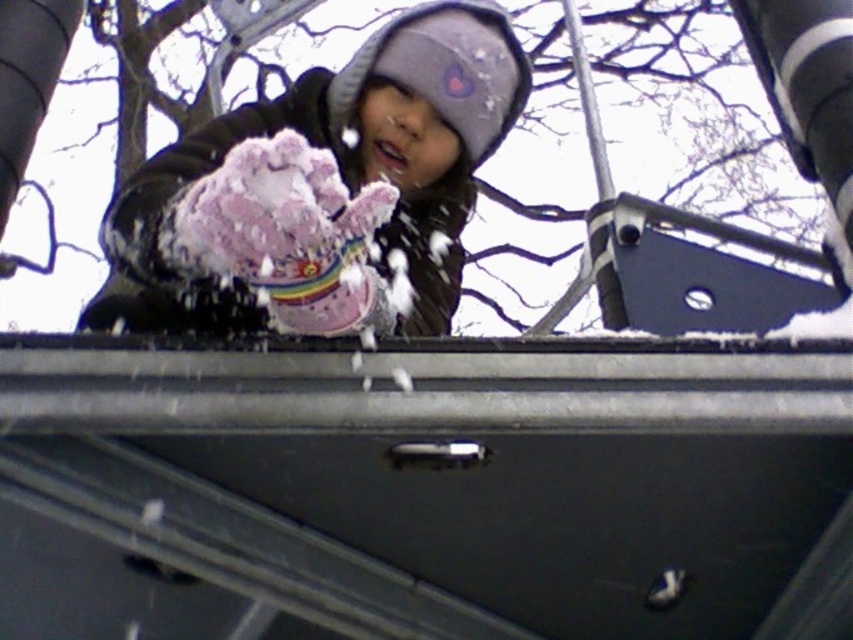
You are a child trying to put on both the pink fuzzy glove at center and the pink fluffy glove at center. Which glove will you need to stretch your hand more to fit into?

The pink fuzzy glove at center requires stretching more because it is wider than the pink fluffy glove at center.

You are a parent trying to ensure your child has both gloves on. You notice the child has two pink gloves at the center of the scene. How far apart are the pink fuzzy glove at center and the pink fluffy glove at center?

The pink fuzzy glove at center is 11.67 inches away from the pink fluffy glove at center, so they are 11.67 inches apart.